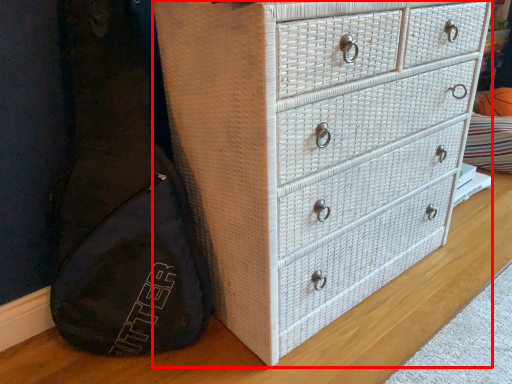
Question: From the image's perspective, what is the correct spatial relationship of chest of drawers (annotated by the red box) in relation to basketball?

Choices:
 (A) below
 (B) above

Answer: (A)